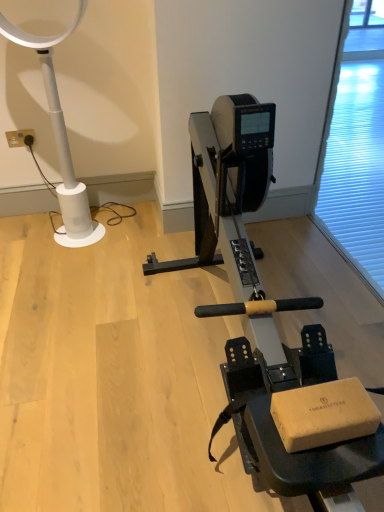
Locate an element on the screen. free space to the left of white plastic lamp at left is located at coordinates (28, 234).